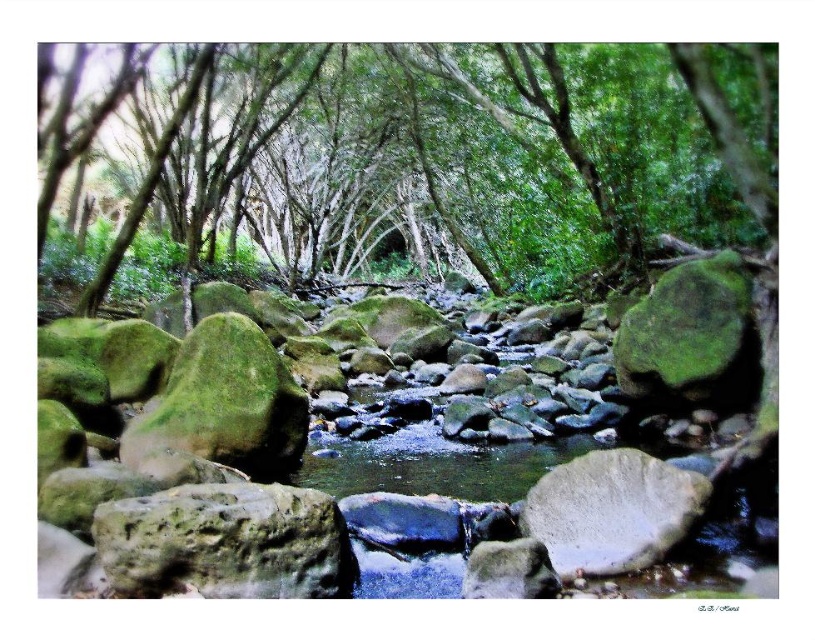
You are a hiker who wants to cross the stream. You see the green mossy rock at lower left and the white smooth rock at center. Which rock is shorter and easier to step on?

The green mossy rock at lower left has a lesser height compared to the white smooth rock at center, so it is shorter and easier to step on.

You are a hiker carrying a 10 meter rope and want to cross the stream between the green mossy tree at center and the green mossy rock at lower left. Can you safely cross using the rope?

The distance between the green mossy tree at center and the green mossy rock at lower left is 9.09 meters, so the 10 meter rope is long enough to safely cross the stream between them.